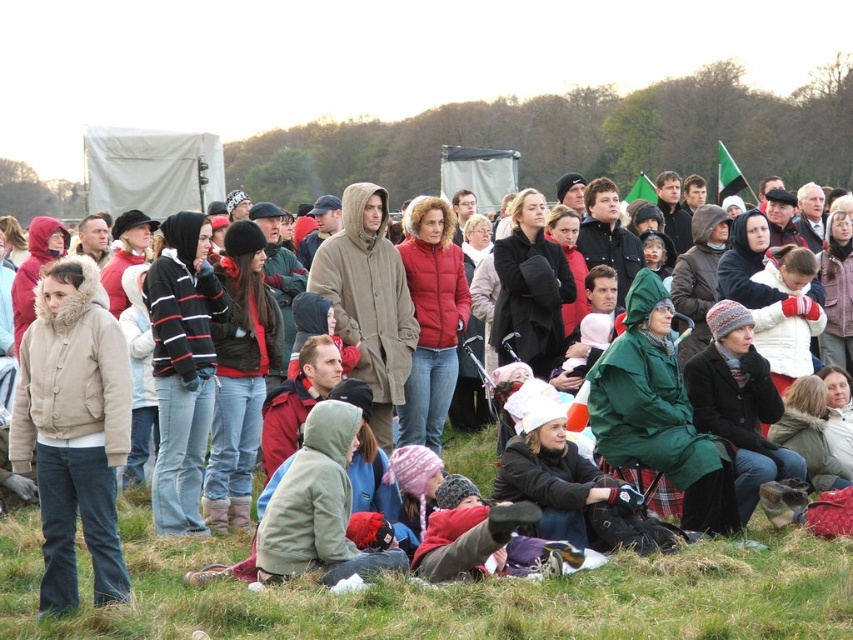
Does matte green coat at center appear on the right side of green grass at lower center?

Indeed, matte green coat at center is positioned on the right side of green grass at lower center.

Looking at this image, can you confirm if matte green coat at center is wider than green grass at lower center?

Yes.

The image size is (853, 640). What do you see at coordinates (451, 593) in the screenshot?
I see `matte green coat at center` at bounding box center [451, 593].

Identify the location of matte green coat at center. [x=451, y=593].

Does matte green coat at center have a lesser width compared to beige fur-lined jacket at left?

No, matte green coat at center is not thinner than beige fur-lined jacket at left.

Is matte green coat at center taller than beige fur-lined jacket at left?

Yes, matte green coat at center is taller than beige fur-lined jacket at left.

Is point (804, 621) less distant than point (96, 496)?

Yes.

Where is `matte green coat at center`? This screenshot has height=640, width=853. matte green coat at center is located at coordinates (451, 593).

Which is below, green grass at lower center or beige fur-lined jacket at left?

green grass at lower center

Which is behind, point (683, 634) or point (105, 324)?

The point (105, 324) is more distant.

Is point (283, 616) more distant than point (107, 544)?

No.

Identify the location of green grass at lower center. Image resolution: width=853 pixels, height=640 pixels. (451, 593).